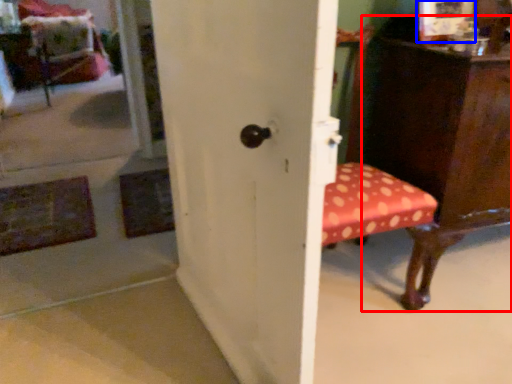
Question: Which object appears farthest to the camera in this image, furniture (highlighted by a red box) or picture frame (highlighted by a blue box)?

Choices:
 (A) furniture
 (B) picture frame

Answer: (B)